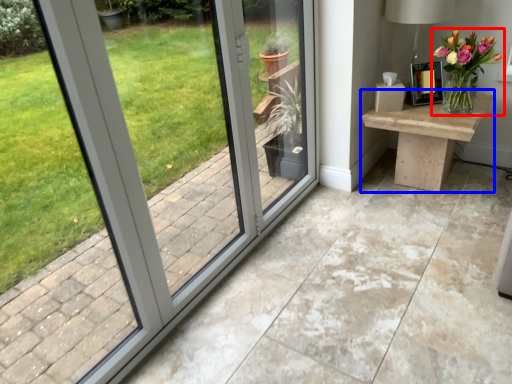
Question: Which point is further to the camera, houseplant (highlighted by a red box) or table (highlighted by a blue box)?

Choices:
 (A) houseplant
 (B) table

Answer: (B)